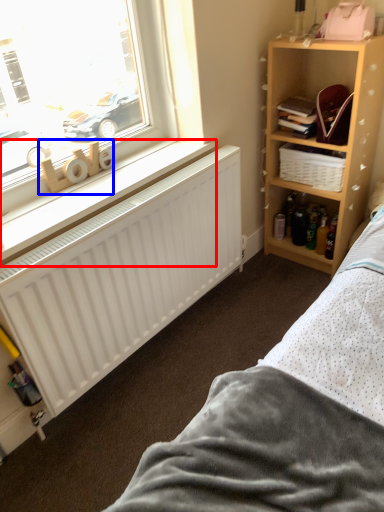
Question: Which of the following is the farthest to the observer, window sill (highlighted by a red box) or toy (highlighted by a blue box)?

Choices:
 (A) window sill
 (B) toy

Answer: (B)